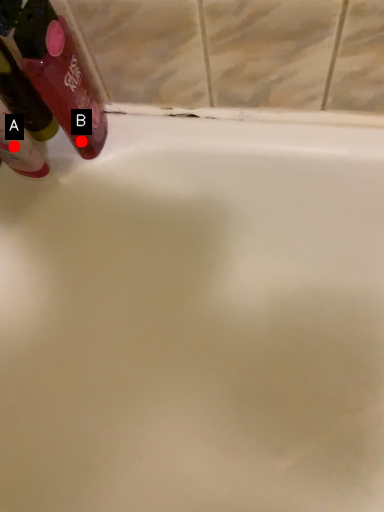
Question: Two points are circled on the image, labeled by A and B beside each circle. Which point is farther from the camera taking this photo?

Choices:
 (A) A is further
 (B) B is further

Answer: (B)